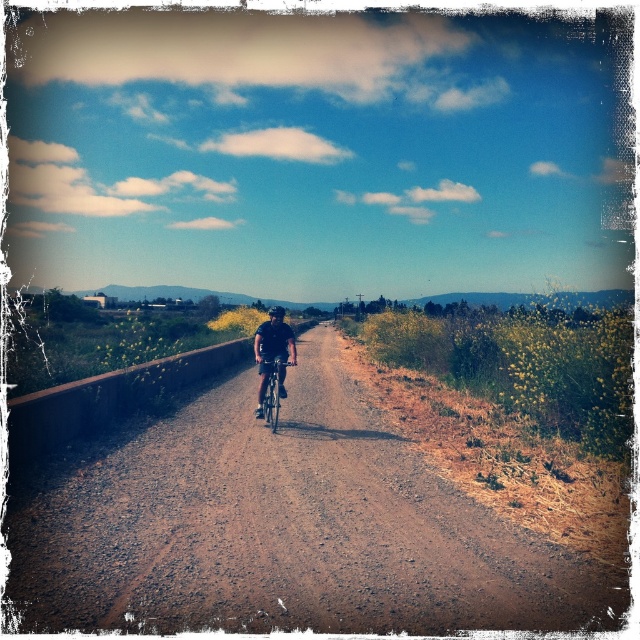
Is point (268, 381) closer to camera compared to point (269, 316)?

Yes, point (268, 381) is closer to viewer.

Can you confirm if shiny metallic bicycle at center is smaller than black matte bicycle helmet at center?

Yes, shiny metallic bicycle at center is smaller than black matte bicycle helmet at center.

Between point (273, 378) and point (273, 310), which one is positioned behind?

Positioned behind is point (273, 310).

Where is `shiny metallic bicycle at center`? Image resolution: width=640 pixels, height=640 pixels. shiny metallic bicycle at center is located at coordinates (273, 392).

Does point (280, 339) lie in front of point (273, 388)?

No, it is behind (273, 388).

Is black matte bicycle at center taller than shiny metallic bicycle at center?

Correct, black matte bicycle at center is much taller as shiny metallic bicycle at center.

Which is in front, point (259, 340) or point (262, 412)?

Point (262, 412)

Find the location of a particular element. This screenshot has height=640, width=640. black matte bicycle at center is located at coordinates (273, 353).

From the picture: Does black matte bicycle at center have a smaller size compared to black matte bicycle helmet at center?

Yes.

Who is lower down, black matte bicycle at center or black matte bicycle helmet at center?

black matte bicycle at center is below.

Locate an element on the screen. black matte bicycle at center is located at coordinates (273, 353).